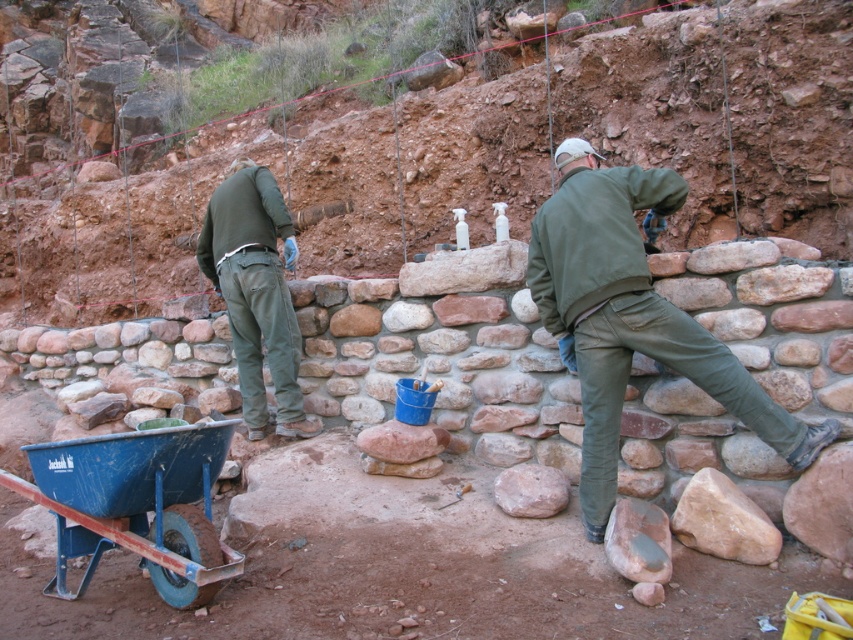
Is blue plastic cart at lower left taller than green matte pants at center?

No.

Can you confirm if blue plastic cart at lower left is positioned below green matte pants at center?

Yes, blue plastic cart at lower left is below green matte pants at center.

Where is `blue plastic cart at lower left`? blue plastic cart at lower left is located at coordinates (136, 504).

Does green matte jacket at center have a greater height compared to blue plastic cart at lower left?

Yes.

Does point (616, 296) come in front of point (61, 529)?

Yes, point (616, 296) is in front of point (61, 529).

The height and width of the screenshot is (640, 853). Identify the location of green matte jacket at center. (631, 317).

In the scene shown: Who is more distant from viewer, (590, 438) or (273, 180)?

Point (273, 180)

Between green matte jacket at center and green matte pants at center, which one appears on the right side from the viewer's perspective?

Positioned to the right is green matte jacket at center.

The width and height of the screenshot is (853, 640). Describe the element at coordinates (631, 317) in the screenshot. I see `green matte jacket at center` at that location.

Image resolution: width=853 pixels, height=640 pixels. I want to click on green matte jacket at center, so click(631, 317).